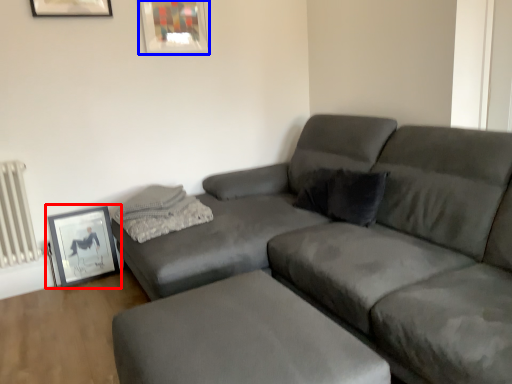
Question: Among these objects, which one is nearest to the camera, picture frame (highlighted by a red box) or picture frame (highlighted by a blue box)?

Choices:
 (A) picture frame
 (B) picture frame

Answer: (A)